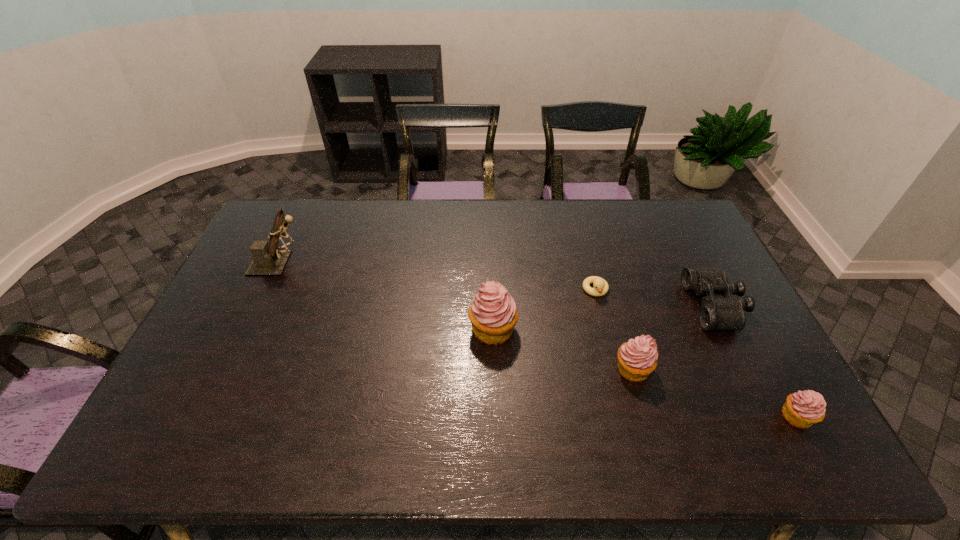
What are the coordinates of `binoculars that is at the right edge` in the screenshot? It's located at (x=716, y=313).

This screenshot has width=960, height=540. I want to click on object that is at the near right corner, so click(x=802, y=409).

This screenshot has height=540, width=960. In the image, there is a desktop. Find the location of `vacant space at the far edge`. vacant space at the far edge is located at coordinates (497, 223).

Where is `free region at the near edge`? free region at the near edge is located at coordinates (375, 387).

I want to click on vacant space at the left edge of the desktop, so click(258, 339).

Identify the location of vacant space at the far left corner of the desktop. The width and height of the screenshot is (960, 540). tap(261, 228).

You are a GUI agent. You are given a task and a screenshot of the screen. Output one action in this format:
    pyautogui.click(x=<x>, y=<y>)
    Task: Click on the free space at the far right corner of the desktop
    The height and width of the screenshot is (540, 960).
    Given the screenshot: What is the action you would take?
    pyautogui.click(x=648, y=204)

The width and height of the screenshot is (960, 540). I want to click on free spot between the leftmost cupcake and the binoculars, so click(x=604, y=318).

This screenshot has width=960, height=540. In order to click on empty location between the duckling and the rightmost cupcake in this screenshot , I will do `click(696, 353)`.

Where is `empty space between the nearest cupcake and the leftmost object`? The image size is (960, 540). empty space between the nearest cupcake and the leftmost object is located at coordinates (539, 340).